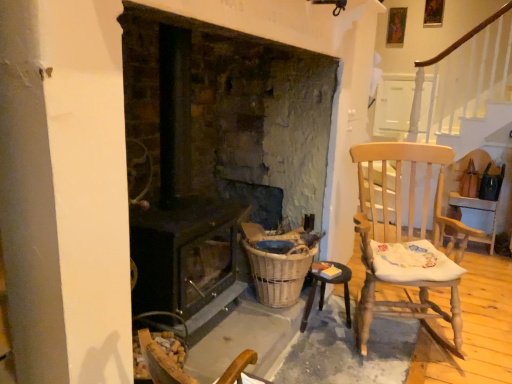
Locate an element on the screen. The image size is (512, 384). free spot in front of wooden table at lower right is located at coordinates (334, 351).